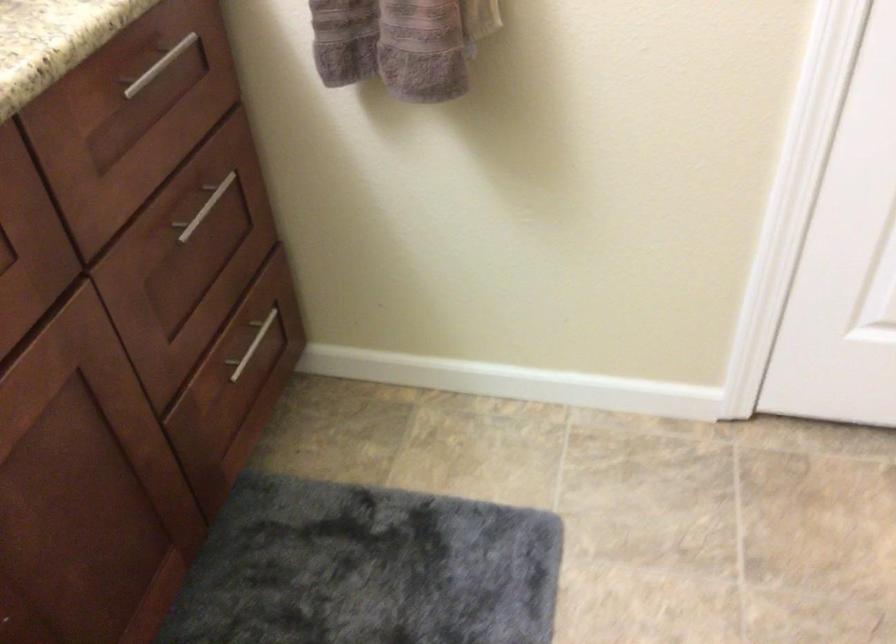
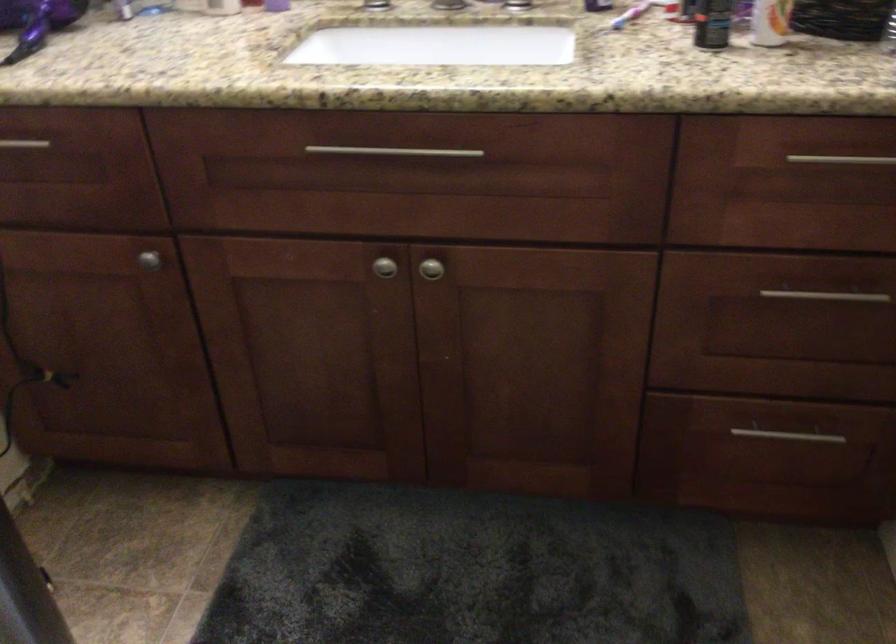
Where in the second image is the point corresponding to (251,363) from the first image?

(778, 446)